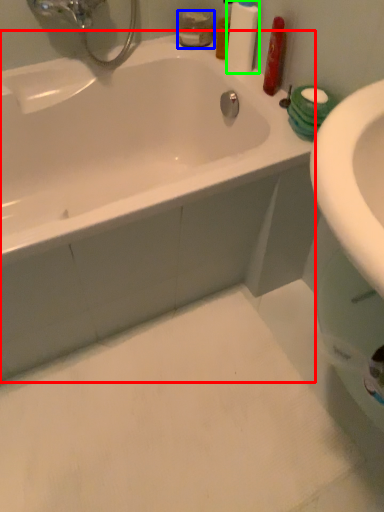
Question: Considering the real-world distances, which object is closest to bathtub (highlighted by a red box)? mouthwash (highlighted by a blue box) or cleaning product (highlighted by a green box).

Choices:
 (A) mouthwash
 (B) cleaning product

Answer: (B)